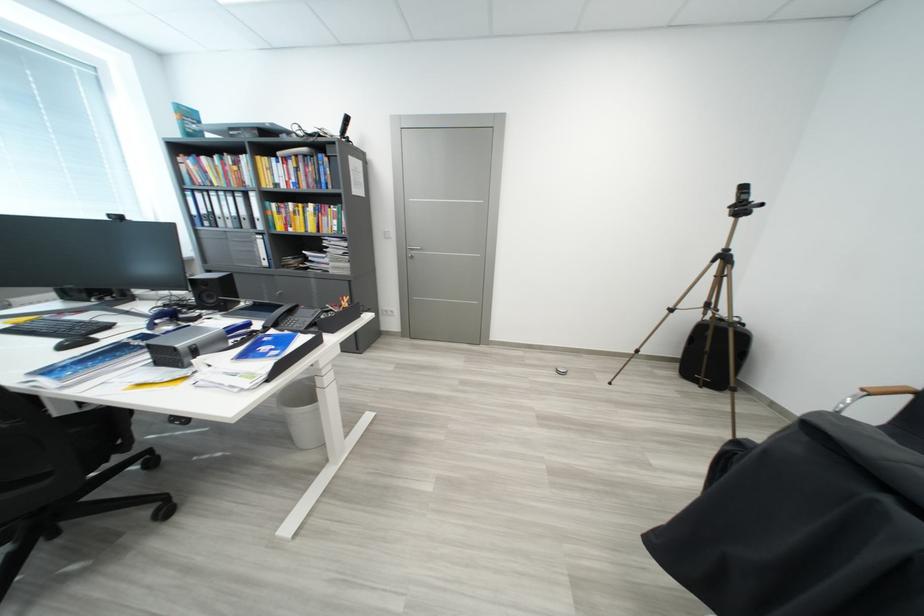
This screenshot has width=924, height=616. I want to click on chair armrest, so click(873, 394).